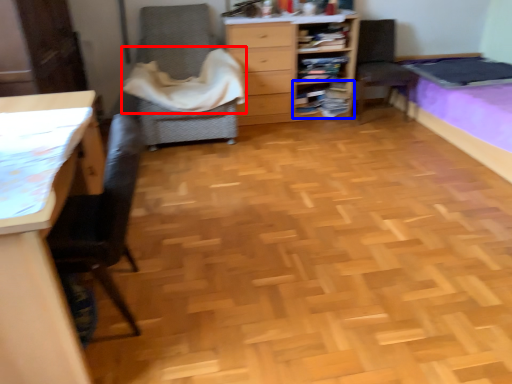
Question: Among these objects, which one is farthest to the camera, blanket (highlighted by a red box) or shelf (highlighted by a blue box)?

Choices:
 (A) blanket
 (B) shelf

Answer: (B)